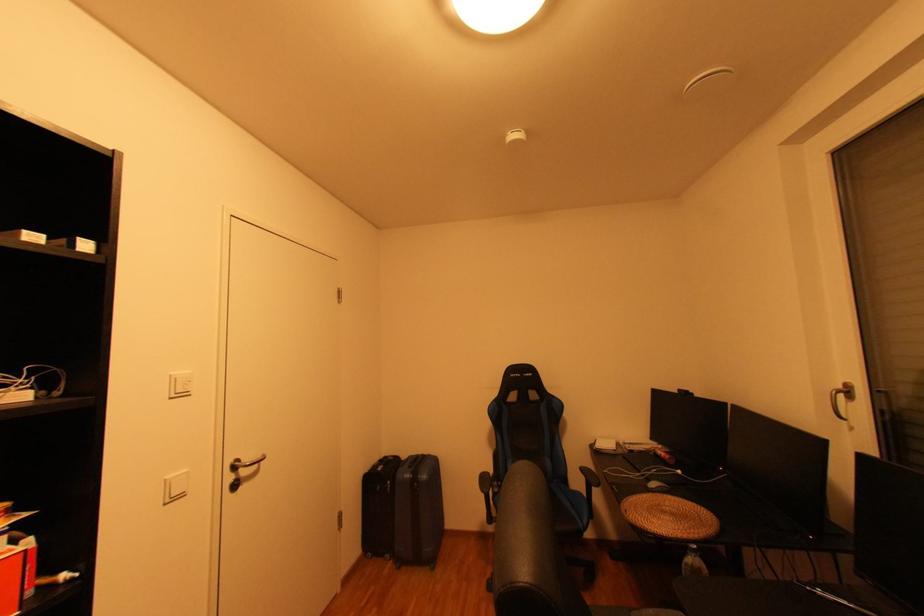
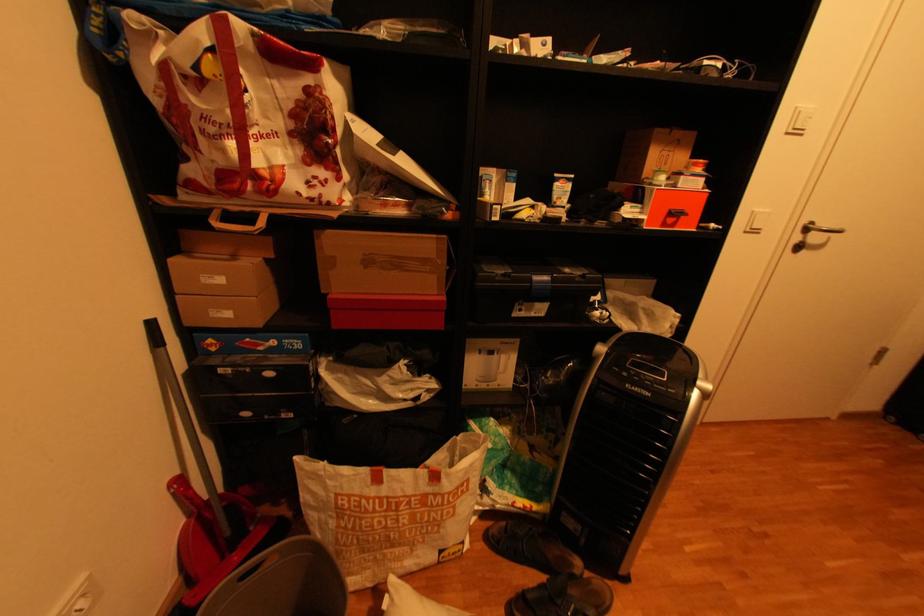
In the second image, find the point that corresponds to (x=177, y=477) in the first image.

(766, 209)